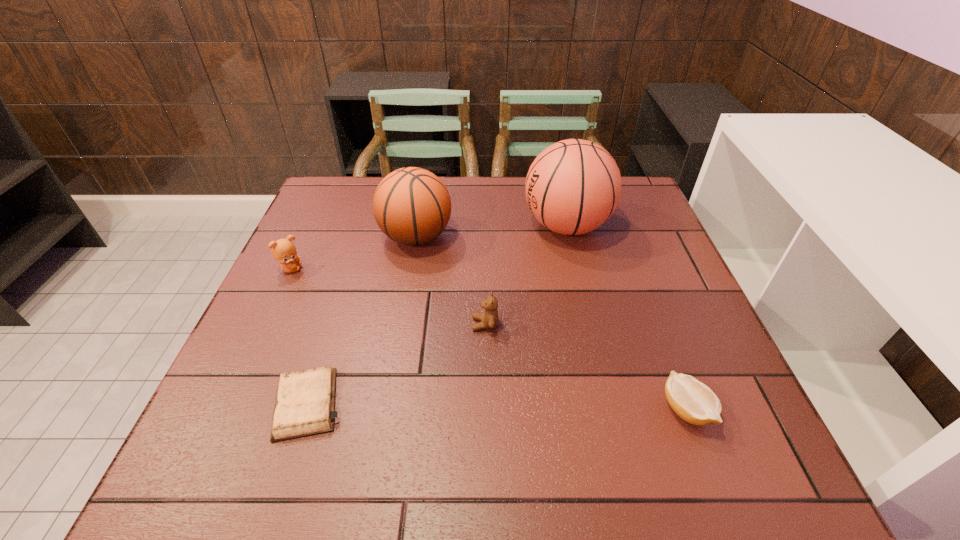
The width and height of the screenshot is (960, 540). Find the location of `free space at the far left corner of the desktop`. free space at the far left corner of the desktop is located at coordinates (368, 177).

I want to click on free spot between the right basketball and the nearer teddy bear, so click(x=526, y=275).

At what (x,y) coordinates should I click in order to perform the action: click on vacant area that lies between the tallest object and the shortest object. Please return your answer as a coordinate pair (x, y). Looking at the image, I should click on (437, 315).

You are a GUI agent. You are given a task and a screenshot of the screen. Output one action in this format:
    pyautogui.click(x=<x>, y=<y>)
    Task: Click on the free point between the leftmost object and the diary
    The width and height of the screenshot is (960, 540).
    Given the screenshot: What is the action you would take?
    pyautogui.click(x=299, y=336)

Locate an element on the screen. unoccupied area between the tallest object and the left basketball is located at coordinates (492, 231).

Find the location of `vacant space that is in between the fifth tallest object and the taller basketball`. vacant space that is in between the fifth tallest object and the taller basketball is located at coordinates (626, 318).

Where is `free spot between the second shortest object and the tallest object`? This screenshot has height=540, width=960. free spot between the second shortest object and the tallest object is located at coordinates (626, 318).

In order to click on vacant space that's between the lemon and the shortest object in this screenshot , I will do `click(496, 407)`.

Identify the location of vacant area that lies between the fifth shortest object and the fifth tallest object. This screenshot has width=960, height=540. (551, 323).

What are the coordinates of `blank region between the taller basketball and the left teddy bear` in the screenshot? It's located at (428, 247).